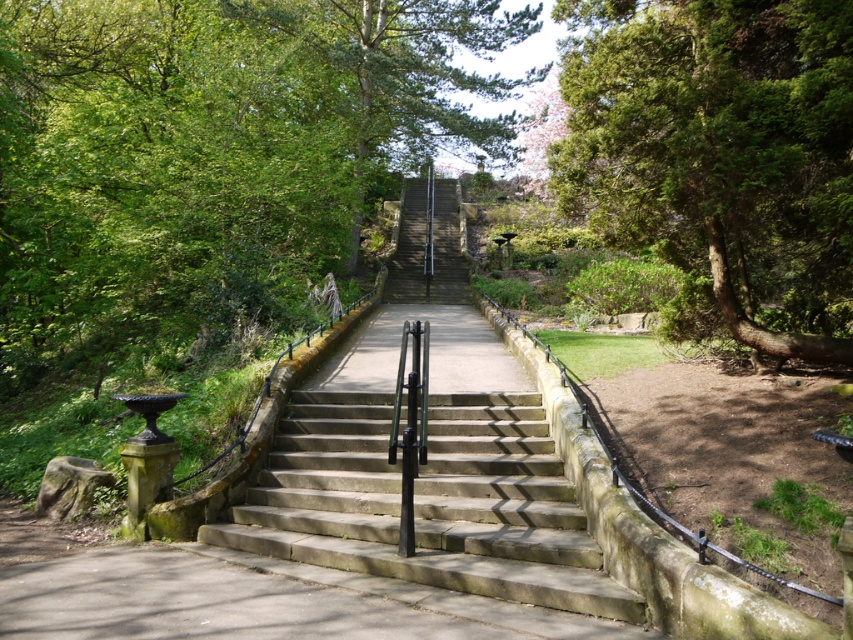
Is point (241, 129) farther from camera compared to point (618, 42)?

Yes, point (241, 129) is farther from viewer.

Can you confirm if green leafy tree at upper center is bigger than green textured tree at upper right?

Indeed, green leafy tree at upper center has a larger size compared to green textured tree at upper right.

What do you see at coordinates (212, 157) in the screenshot? The image size is (853, 640). I see `green leafy tree at upper center` at bounding box center [212, 157].

This screenshot has height=640, width=853. Identify the location of green leafy tree at upper center. (212, 157).

Who is positioned more to the left, green leafy tree at upper center or stone stairs at center?

green leafy tree at upper center is more to the left.

Is green leafy tree at upper center below stone stairs at center?

Actually, green leafy tree at upper center is above stone stairs at center.

This screenshot has height=640, width=853. I want to click on green leafy tree at upper center, so click(x=212, y=157).

Between green textured tree at upper right and stone stairs at center, which one appears on the left side from the viewer's perspective?

stone stairs at center is more to the left.

Does point (743, 262) lie in front of point (326, 401)?

Yes, it is.

Is point (784, 336) closer to camera compared to point (618, 608)?

No, (784, 336) is further to viewer.

In order to click on green textured tree at upper right in this screenshot , I will do (720, 157).